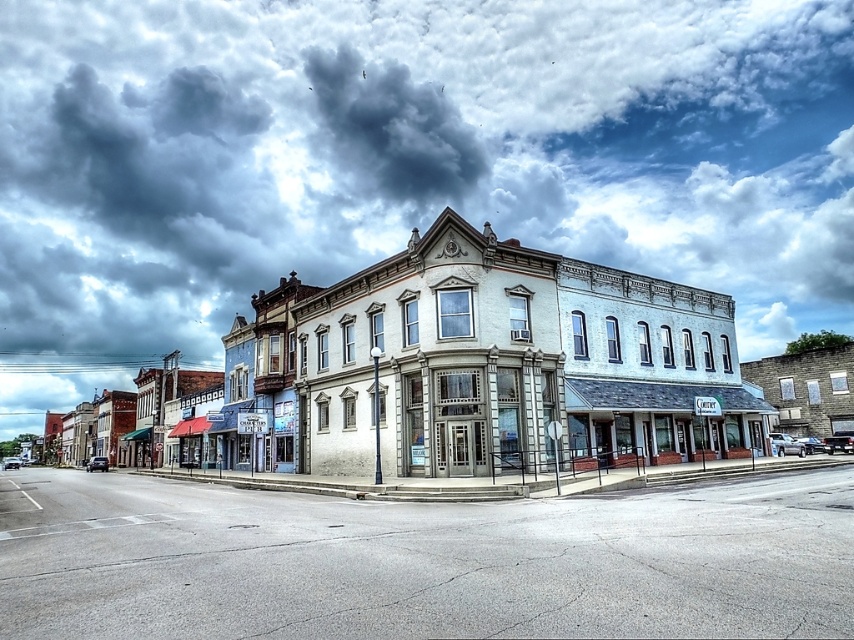
Question: Which object is positioned farthest from the white stone building at center?

Choices:
 (A) cloudy sky at upper center
 (B) gray asphalt at center

Answer: (A)

Question: Which of the following is the closest to the observer?

Choices:
 (A) gray asphalt at center
 (B) white stone building at center
 (C) cloudy sky at upper center

Answer: (A)

Question: Which object appears farthest from the camera in this image?

Choices:
 (A) gray asphalt at center
 (B) cloudy sky at upper center

Answer: (B)

Question: Does gray asphalt at center appear on the left side of white stone building at center?

Choices:
 (A) no
 (B) yes

Answer: (A)

Question: Can you confirm if gray asphalt at center is bigger than white stone building at center?

Choices:
 (A) yes
 (B) no

Answer: (B)

Question: Is the position of cloudy sky at upper center less distant than that of gray asphalt at center?

Choices:
 (A) yes
 (B) no

Answer: (B)